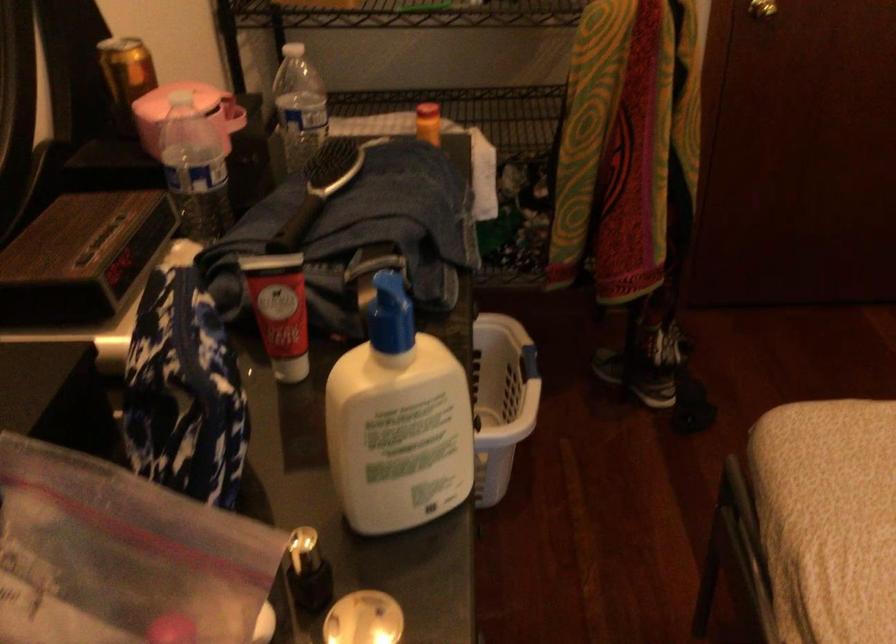
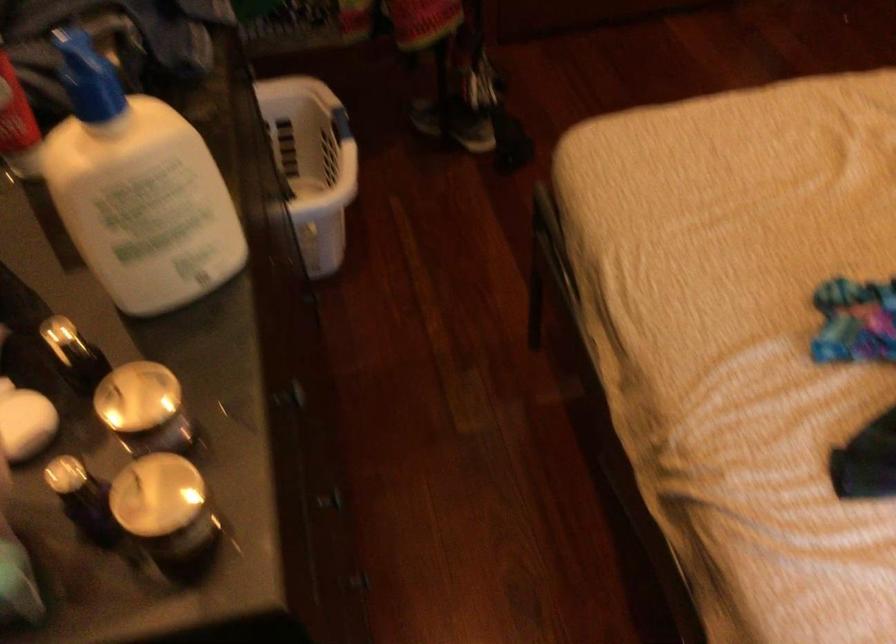
Locate, in the second image, the point that corresponds to the point at 385,330 in the first image.

(88, 77)